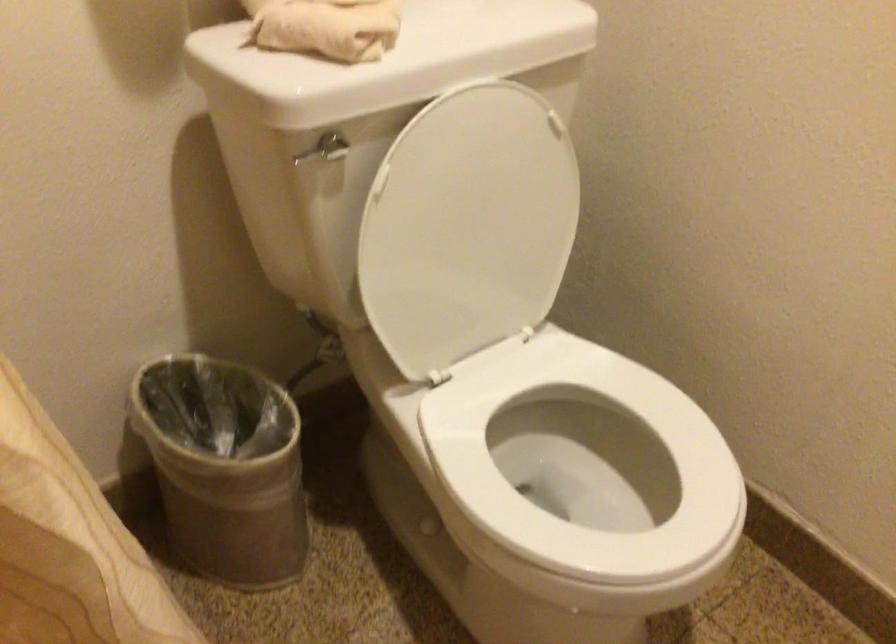
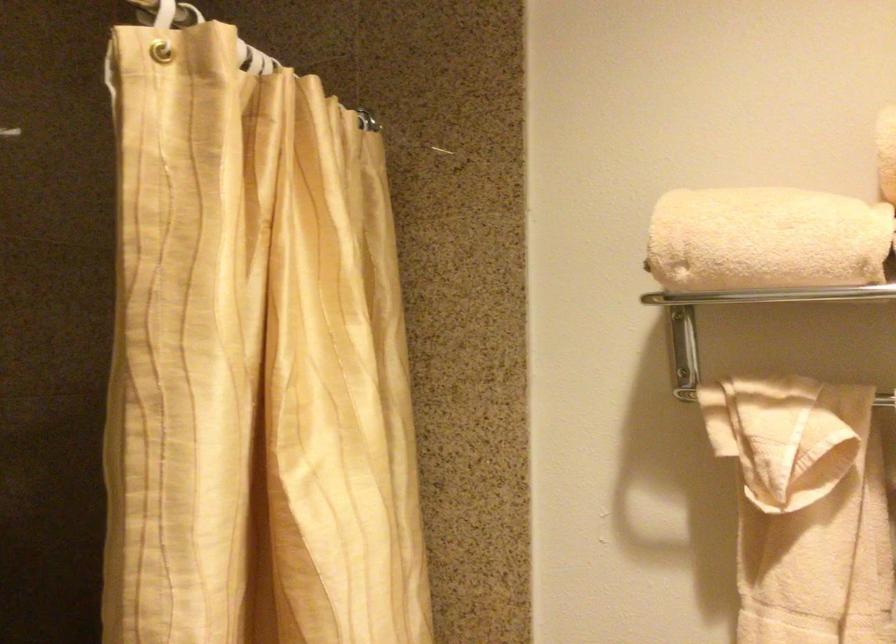
The images are taken continuously from a first-person perspective. In which direction is your viewpoint rotating?

The camera rotated toward left-up.